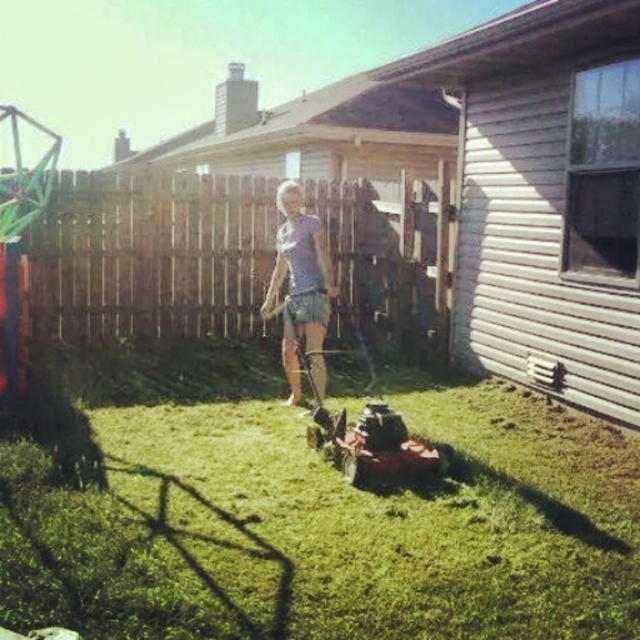
Between point (180, 342) and point (200, 193), which one is positioned behind?

Positioned behind is point (200, 193).

Is green grass at center to the left of brown wooden fence at center from the viewer's perspective?

In fact, green grass at center is to the right of brown wooden fence at center.

In order to click on green grass at center in this screenshot , I will do 304,509.

Who is taller, green grass at center or light blue denim shorts at center?

With more height is light blue denim shorts at center.

Who is higher up, green grass at center or light blue denim shorts at center?

light blue denim shorts at center

Describe the element at coordinates (304, 509) in the screenshot. This screenshot has width=640, height=640. I see `green grass at center` at that location.

Find the location of a particular element. This screenshot has height=640, width=640. green grass at center is located at coordinates (304, 509).

Does brown wooden fence at center have a greater height compared to light blue denim shorts at center?

No, brown wooden fence at center is not taller than light blue denim shorts at center.

The height and width of the screenshot is (640, 640). What are the coordinates of `brown wooden fence at center` in the screenshot? It's located at pyautogui.click(x=150, y=253).